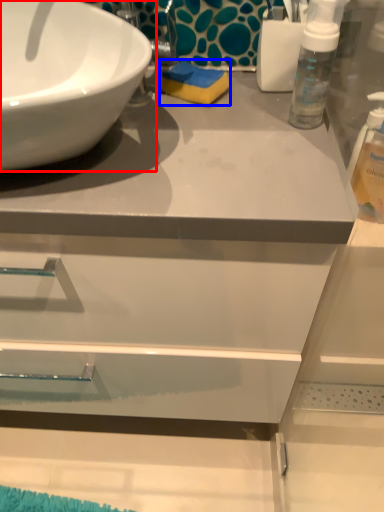
Question: Which object appears farthest to the camera in this image, sink (highlighted by a red box) or soap (highlighted by a blue box)?

Choices:
 (A) sink
 (B) soap

Answer: (B)